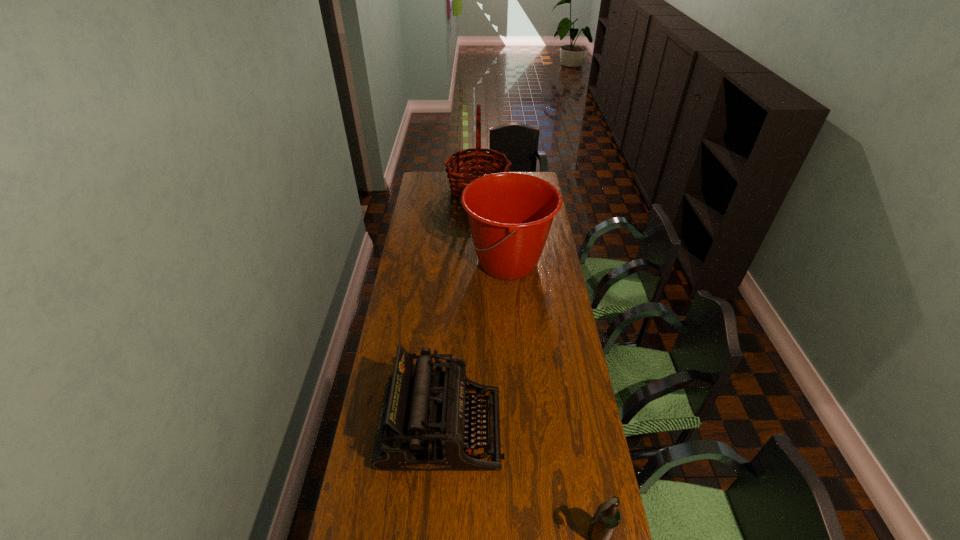
The width and height of the screenshot is (960, 540). Identify the location of basket. (474, 162).

Locate an element on the screen. Image resolution: width=960 pixels, height=540 pixels. the farthest object is located at coordinates (474, 162).

Where is `bucket`? Image resolution: width=960 pixels, height=540 pixels. bucket is located at coordinates (510, 214).

The width and height of the screenshot is (960, 540). What are the coordinates of `the third nearest object` in the screenshot? It's located at (510, 214).

You are a GUI agent. You are given a task and a screenshot of the screen. Output one action in this format:
    pyautogui.click(x=<x>, y=<y>)
    Task: Click on the second nearest object
    
    Given the screenshot: What is the action you would take?
    pyautogui.click(x=421, y=427)

The width and height of the screenshot is (960, 540). What are the coordinates of `vacant space situated on the front of the tallest object` in the screenshot? It's located at (477, 224).

Identify the location of free spot located 0.160m with the handle attached to the rim of the second tallest object. (429, 262).

Find the location of a particular element. free space located with the handle attached to the rim of the second tallest object is located at coordinates (408, 262).

The height and width of the screenshot is (540, 960). I want to click on blank area located with the handle attached to the rim of the second tallest object, so click(x=438, y=262).

Find the location of a particular element. This screenshot has height=540, width=960. vacant space positioned 0.050m on the keyboard of the typewriter is located at coordinates (518, 428).